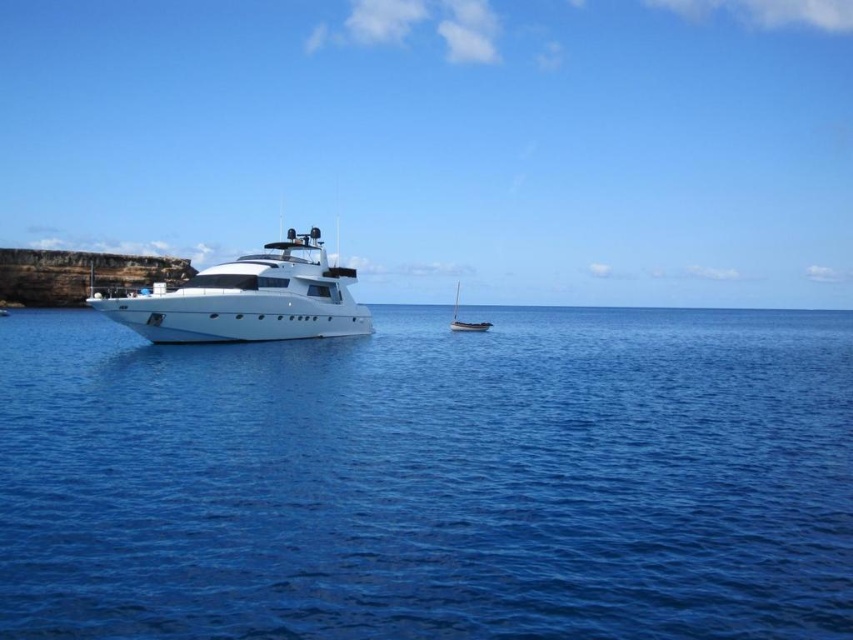
Question: Can you confirm if blue liquid water at center is smaller than white glossy yacht at center?

Choices:
 (A) no
 (B) yes

Answer: (A)

Question: Which of the following is the farthest from the observer?

Choices:
 (A) white glossy yacht at center
 (B) white glossy sailboat at center

Answer: (B)

Question: Does blue liquid water at center have a larger size compared to white glossy yacht at center?

Choices:
 (A) no
 (B) yes

Answer: (B)

Question: Which of these objects is positioned farthest from the white glossy yacht at center?

Choices:
 (A) white glossy sailboat at center
 (B) blue liquid water at center

Answer: (A)

Question: Observing the image, what is the correct spatial positioning of white glossy yacht at center in reference to white glossy sailboat at center?

Choices:
 (A) right
 (B) left

Answer: (B)

Question: Estimate the real-world distances between objects in this image. Which object is farther from the white glossy yacht at center?

Choices:
 (A) blue liquid water at center
 (B) white glossy sailboat at center

Answer: (B)